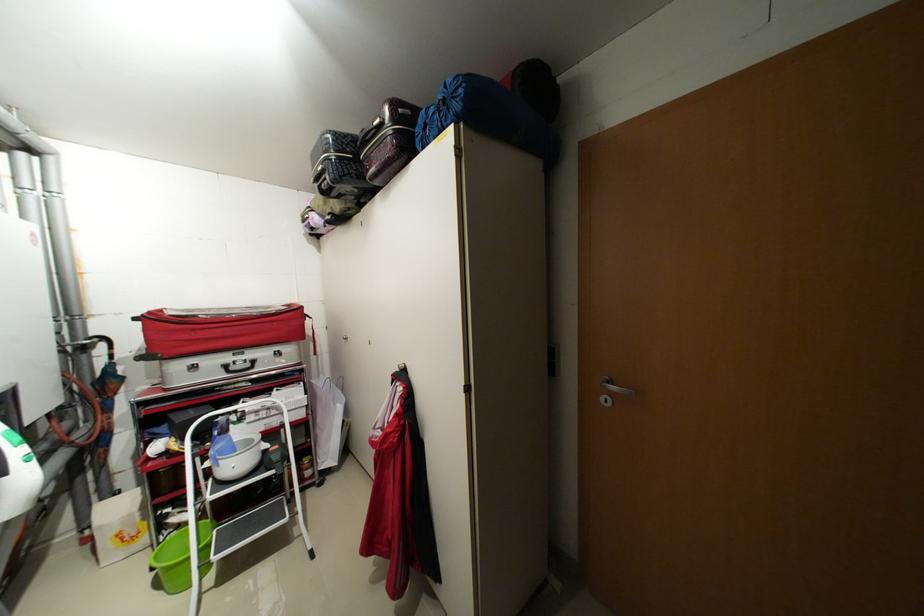
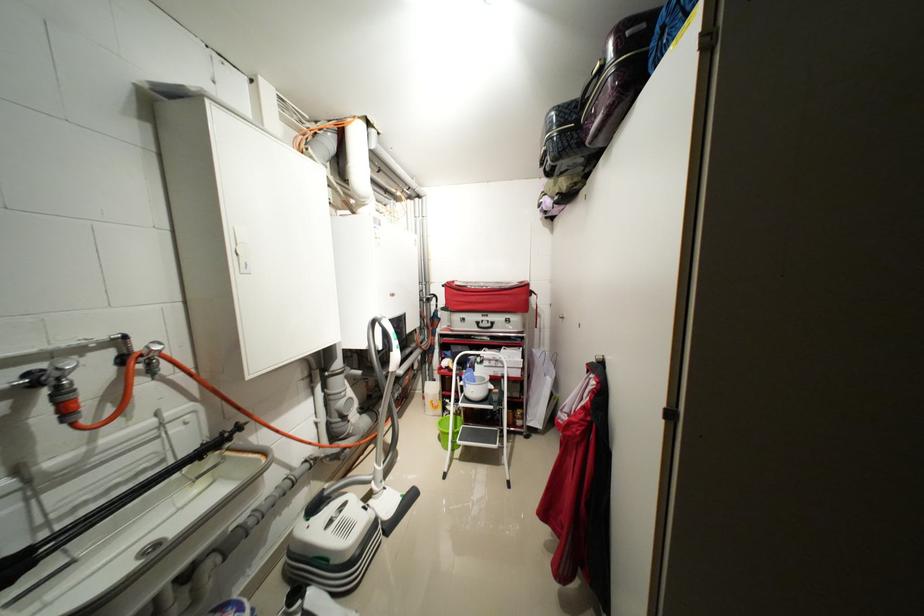
In the second image, find the point that corresponds to [320,464] in the first image.

(530, 418)